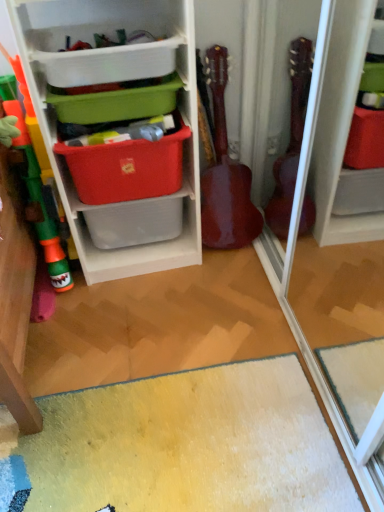
Question: Considering the positions of green plastic storage box at upper center, which ranks as the third storage box in bottom-to-top order, and plastic storage at left in the image, is green plastic storage box at upper center, which ranks as the third storage box in bottom-to-top order, taller or shorter than plastic storage at left?

Choices:
 (A) tall
 (B) short

Answer: (B)

Question: Relative to plastic storage at left, is green plastic storage box at upper center, which ranks as the third storage box in bottom-to-top order, in front or behind?

Choices:
 (A) front
 (B) behind

Answer: (B)

Question: Which object is the closest to the plastic storage at left?

Choices:
 (A) green plastic storage box at upper center, which ranks as the third storage box in bottom-to-top order
 (B) matte plastic storage box at upper center, which is the 2th storage box in top-to-bottom order
 (C) glossy wood guitar at center
 (D) red fabric storage box at center, the first storage box from the bottom

Answer: (A)

Question: Estimate the real-world distances between objects in this image. Which object is closer to the green plastic storage box at upper center, the 1th storage box positioned from the top?

Choices:
 (A) red fabric storage box at center, which is the 3th storage box from top to bottom
 (B) matte plastic storage box at upper center, which is the 2th storage box in top-to-bottom order
 (C) plastic storage at left
 (D) glossy wood guitar at center

Answer: (B)